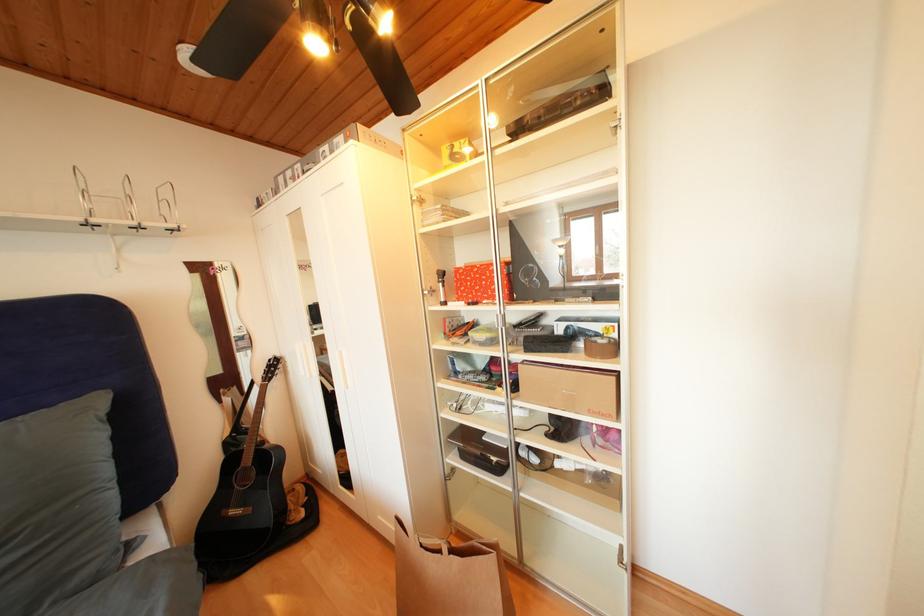
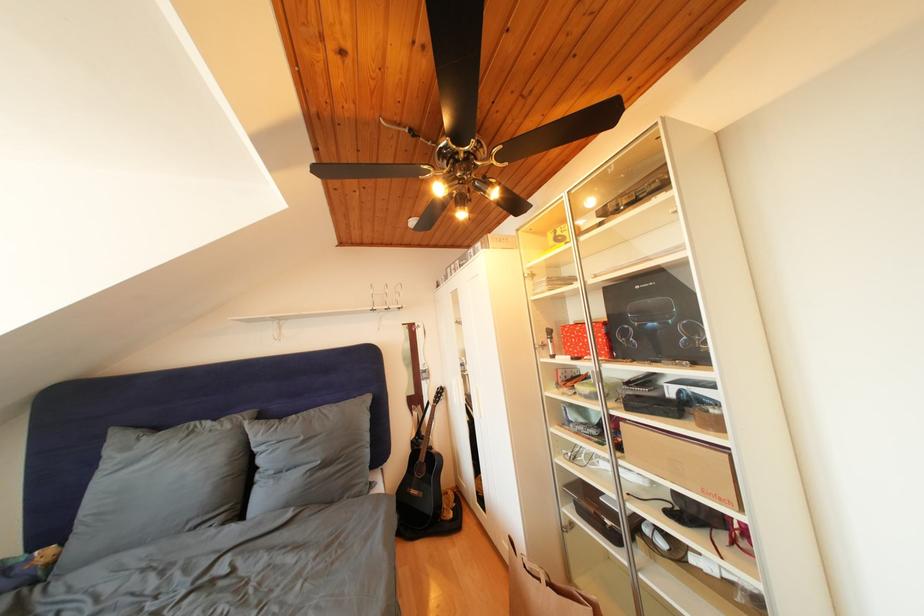
The point at (455, 484) is marked in the first image. Where is the corresponding point in the second image?

(572, 533)